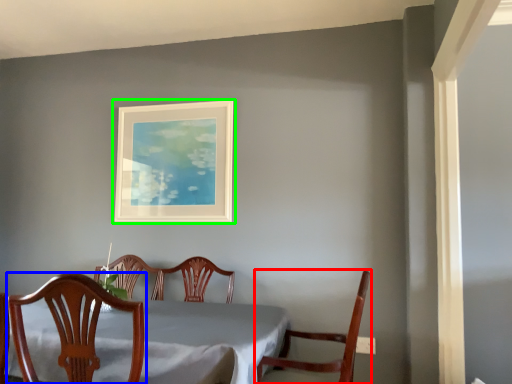
Question: Estimate the real-world distances between objects in this image. Which object is closer to chair (highlighted by a red box), chair (highlighted by a blue box) or picture frame (highlighted by a green box)?

Choices:
 (A) chair
 (B) picture frame

Answer: (A)